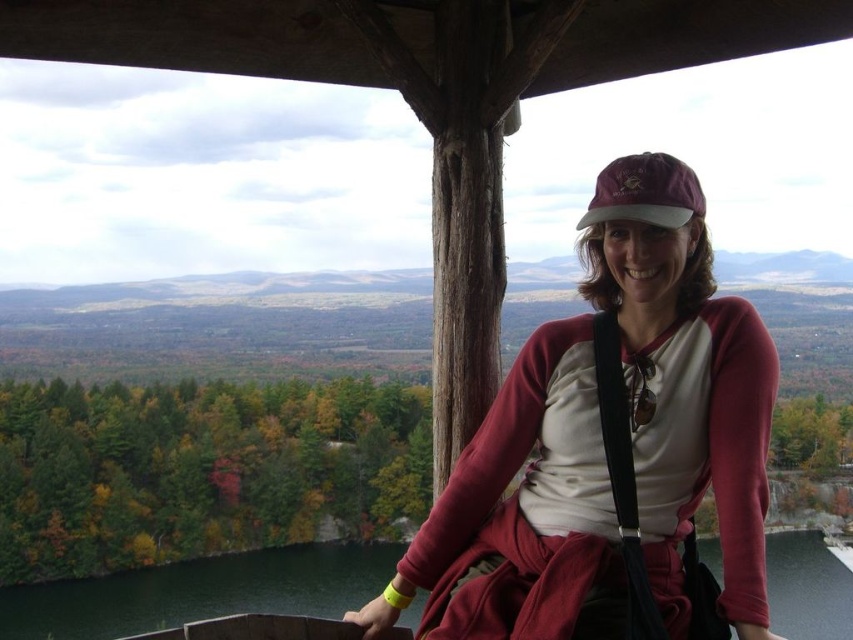
Question: Does matte pink sweater at center have a smaller size compared to maroon fabric baseball cap at upper center?

Choices:
 (A) no
 (B) yes

Answer: (A)

Question: Can you confirm if matte pink sweater at center is positioned below maroon fabric baseball cap at upper center?

Choices:
 (A) no
 (B) yes

Answer: (B)

Question: Can you confirm if matte pink sweater at center is bigger than maroon fabric baseball cap at upper center?

Choices:
 (A) yes
 (B) no

Answer: (A)

Question: Which point is farther to the camera?

Choices:
 (A) maroon fabric baseball cap at upper center
 (B) matte pink sweater at center

Answer: (A)

Question: Among these points, which one is farthest from the camera?

Choices:
 (A) (680, 192)
 (B) (526, 403)

Answer: (B)

Question: Which point is farther to the camera?

Choices:
 (A) pos(647,504)
 (B) pos(604,177)

Answer: (B)